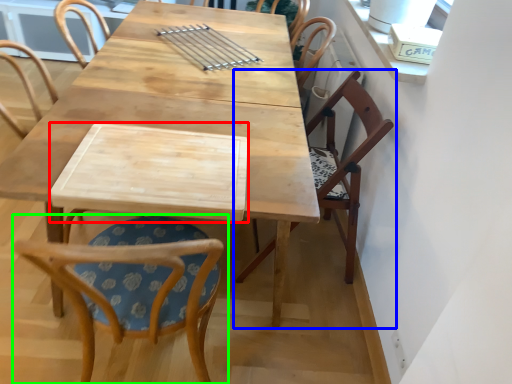
Question: Which object is positioned closest to plank (highlighted by a red box)? Select from chair (highlighted by a blue box) and chair (highlighted by a green box).

Choices:
 (A) chair
 (B) chair

Answer: (B)